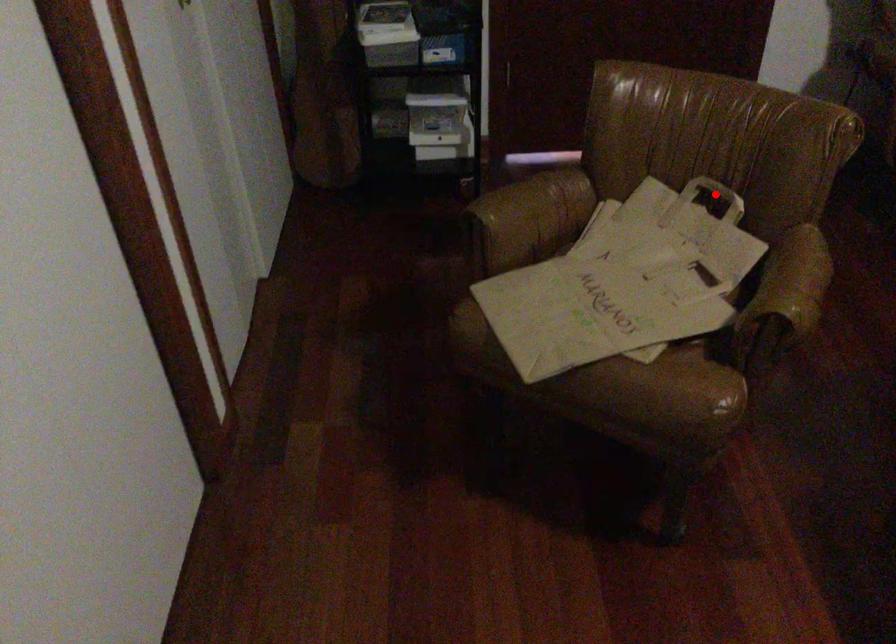
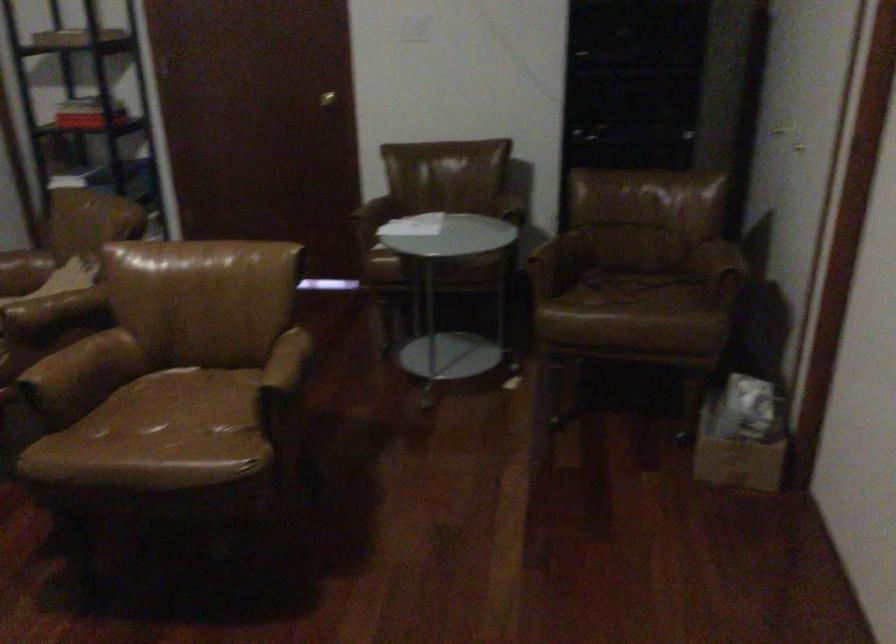
Question: I am providing you with two images of the same scene from different viewpoints. A red point is marked on the first image. Can you still see the location of the red point in image 2?

Choices:
 (A) Yes
 (B) No

Answer: (B)